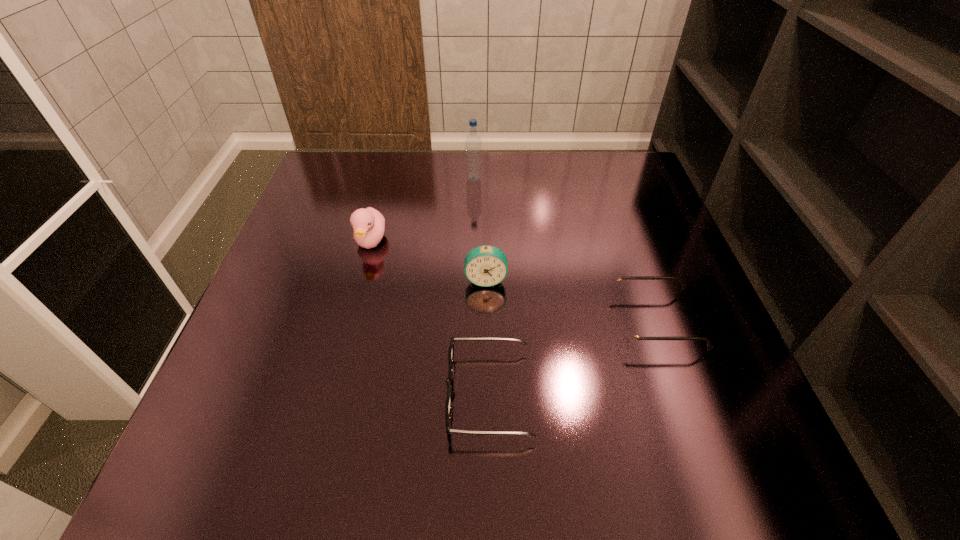
I want to click on empty location between the rightmost object and the second farthest object, so click(x=514, y=281).

Find the location of a particular element. The width and height of the screenshot is (960, 540). unoccupied position between the duckling and the left spectacles is located at coordinates (430, 318).

At what (x,y) coordinates should I click in order to perform the action: click on free space between the third nearest object and the duckling. Please return your answer as a coordinate pair (x, y). The image size is (960, 540). Looking at the image, I should click on (428, 260).

You are a GUI agent. You are given a task and a screenshot of the screen. Output one action in this format:
    pyautogui.click(x=<x>, y=<y>)
    Task: Click on the vacant area that lies between the alarm clock and the left spectacles
    Image resolution: width=960 pixels, height=540 pixels.
    Given the screenshot: What is the action you would take?
    pyautogui.click(x=488, y=336)

Where is `vacant point located between the duckling and the farthest object`? This screenshot has height=540, width=960. vacant point located between the duckling and the farthest object is located at coordinates (422, 210).

The height and width of the screenshot is (540, 960). Identify the location of vacant space that is in between the left spectacles and the third farthest object. (488, 336).

Where is `vacant region between the left spectacles and the alarm clock`? This screenshot has width=960, height=540. vacant region between the left spectacles and the alarm clock is located at coordinates (488, 336).

Where is `object that stands as the third closest to the left spectacles`? This screenshot has height=540, width=960. object that stands as the third closest to the left spectacles is located at coordinates (368, 224).

Choose which object is the second nearest neighbor to the left spectacles. Please provide its 2D coordinates. Your answer should be formatted as a tuple, i.e. [(x, y)], where the tuple contains the x and y coordinates of a point satisfying the conditions above.

[(630, 333)]